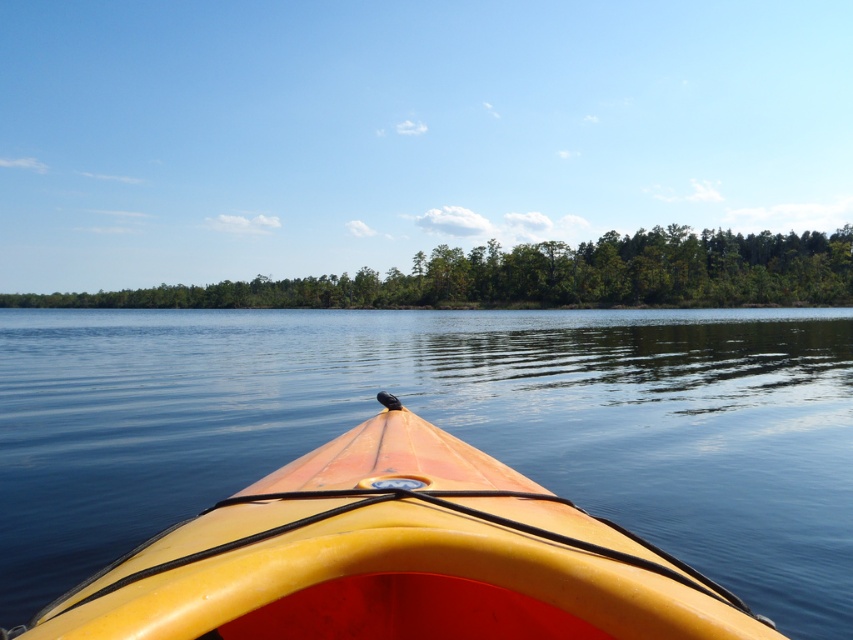
In the scene shown: Is yellow matte kayak at center taller than green leafy trees at center?

In fact, yellow matte kayak at center may be shorter than green leafy trees at center.

Does point (397, 609) come in front of point (851, 256)?

Yes.

Where is `yellow matte kayak at center`? The image size is (853, 640). yellow matte kayak at center is located at coordinates (395, 557).